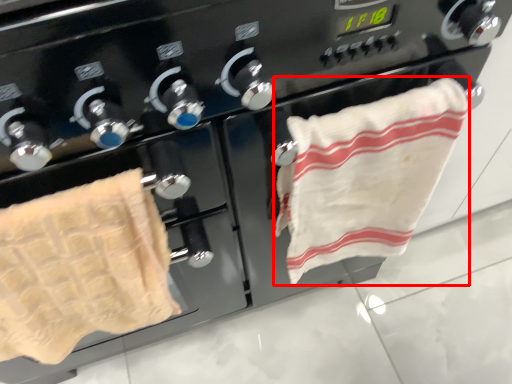
Question: Observing the image, what is the correct spatial positioning of towel (annotated by the red box) in reference to towel?

Choices:
 (A) right
 (B) left

Answer: (A)